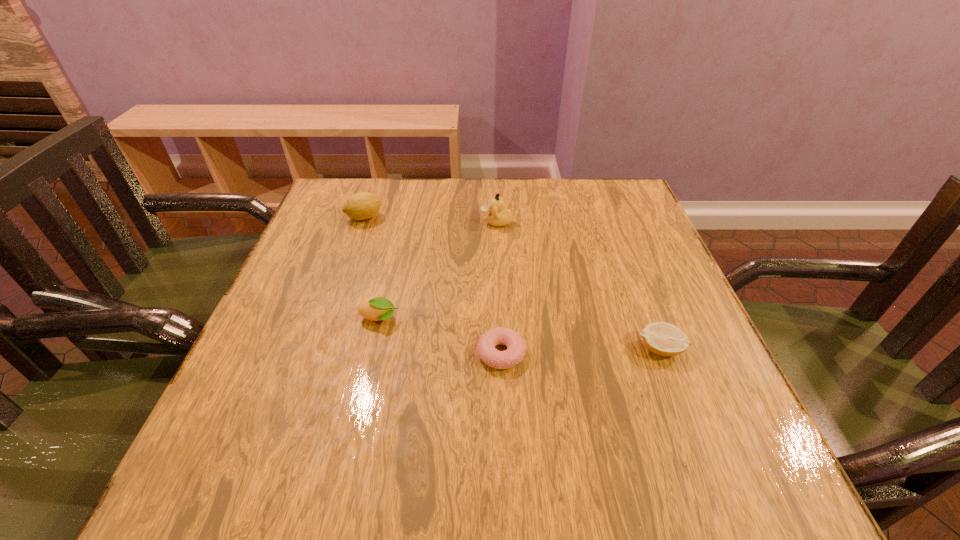
Where is `vacant position located on the face of the tallest object`? vacant position located on the face of the tallest object is located at coordinates point(383,222).

What are the coordinates of `free region located 0.370m at the stem end of the leftmost object` in the screenshot? It's located at (524, 218).

At what (x,y) coordinates should I click in order to perform the action: click on vacant area located with leaves positioned above the fourth object from right to left. Please return your answer as a coordinate pair (x, y). This screenshot has height=540, width=960. Looking at the image, I should click on (578, 319).

Identify the location of free location located on the front of the nearest lemon. Image resolution: width=960 pixels, height=540 pixels. (706, 466).

The height and width of the screenshot is (540, 960). Find the location of `free space located 0.120m on the front of the shortest object`. free space located 0.120m on the front of the shortest object is located at coordinates (505, 437).

The height and width of the screenshot is (540, 960). I want to click on duckling located at the far edge, so click(498, 216).

Where is `lemon that is at the far edge`? Image resolution: width=960 pixels, height=540 pixels. lemon that is at the far edge is located at coordinates (361, 206).

Where is `object positioned at the left edge`? The height and width of the screenshot is (540, 960). object positioned at the left edge is located at coordinates (361, 206).

Image resolution: width=960 pixels, height=540 pixels. In order to click on object located at the right edge in this screenshot , I will do `click(665, 339)`.

The image size is (960, 540). I want to click on object located in the far left corner section of the desktop, so coord(361,206).